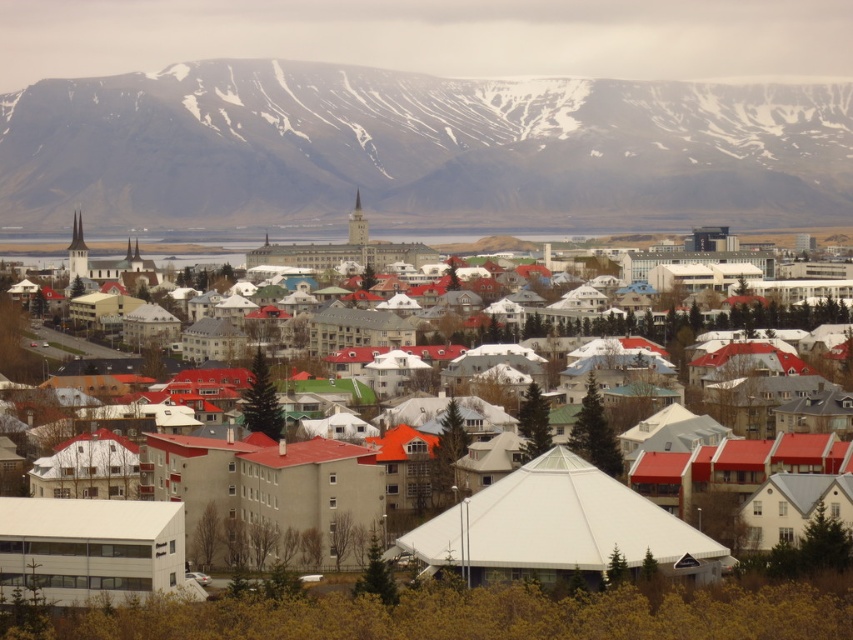
Question: Among these objects, which one is nearest to the camera?

Choices:
 (A) snowy rock formation at upper center
 (B) white matte tent at center

Answer: (B)

Question: Does snowy rock formation at upper center appear under white matte tent at center?

Choices:
 (A) no
 (B) yes

Answer: (A)

Question: Does snowy rock formation at upper center appear under white matte tent at center?

Choices:
 (A) no
 (B) yes

Answer: (A)

Question: Does snowy rock formation at upper center lie in front of white matte tent at center?

Choices:
 (A) yes
 (B) no

Answer: (B)